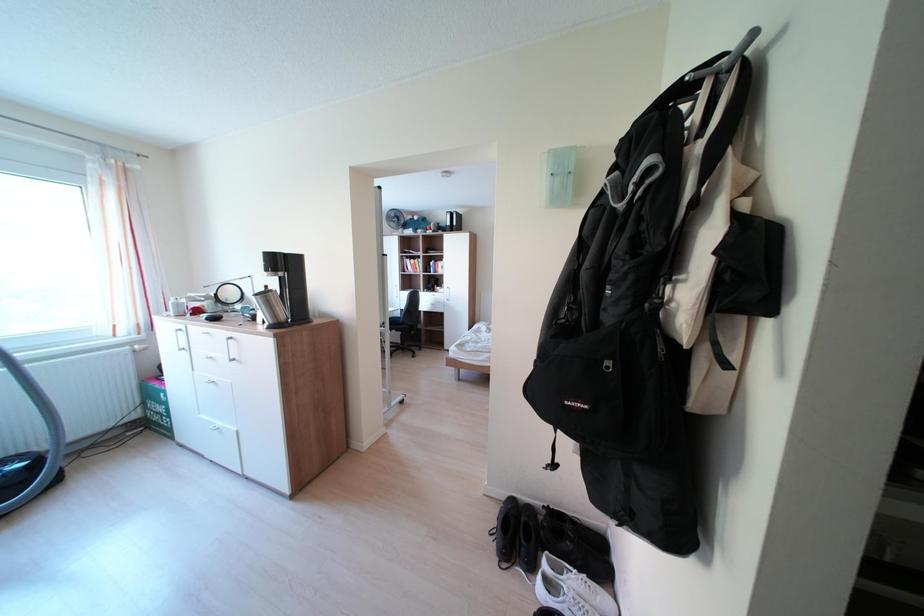
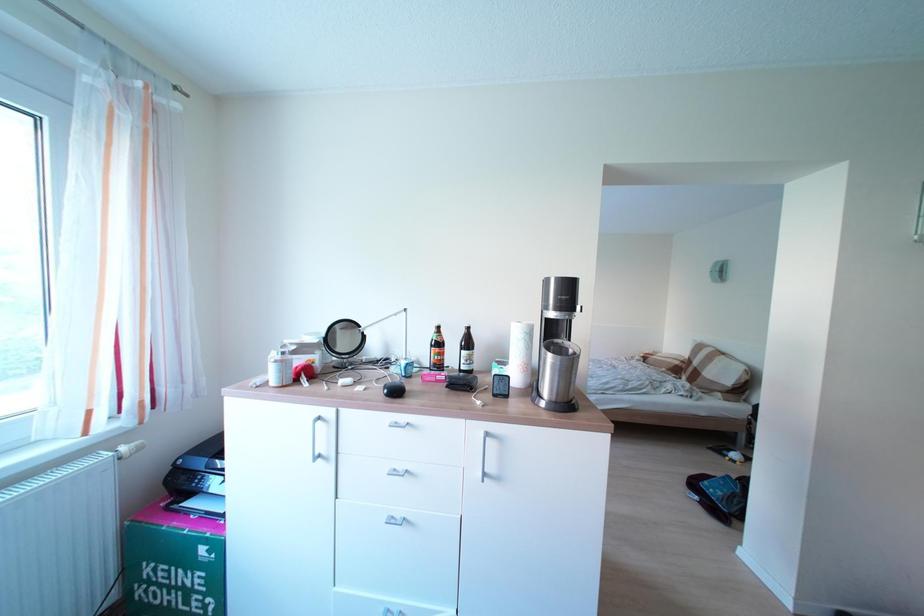
The images are taken continuously from a first-person perspective. In which direction are you moving?

The movement direction of the cameraman is left, forward.